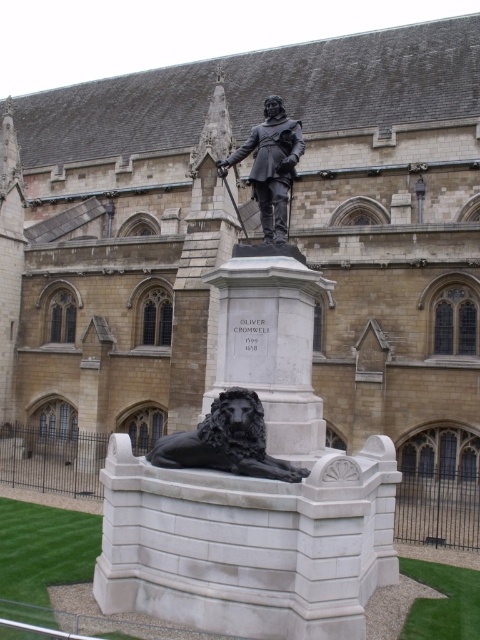
Question: Which object is positioned farthest from the black polished stone statue at center?

Choices:
 (A) bronze statue at center
 (B) black polished stone lion at lower center

Answer: (A)

Question: Can you confirm if black polished stone statue at center is thinner than black polished stone lion at lower center?

Choices:
 (A) yes
 (B) no

Answer: (B)

Question: Which object is the closest to the bronze statue at center?

Choices:
 (A) black polished stone lion at lower center
 (B) black polished stone statue at center

Answer: (B)

Question: Considering the relative positions of black polished stone lion at lower center and bronze statue at center in the image provided, where is black polished stone lion at lower center located with respect to bronze statue at center?

Choices:
 (A) right
 (B) left

Answer: (B)

Question: Which object appears farthest from the camera in this image?

Choices:
 (A) black polished stone statue at center
 (B) bronze statue at center
 (C) black polished stone lion at lower center

Answer: (B)

Question: Is black polished stone statue at center positioned before black polished stone lion at lower center?

Choices:
 (A) yes
 (B) no

Answer: (A)